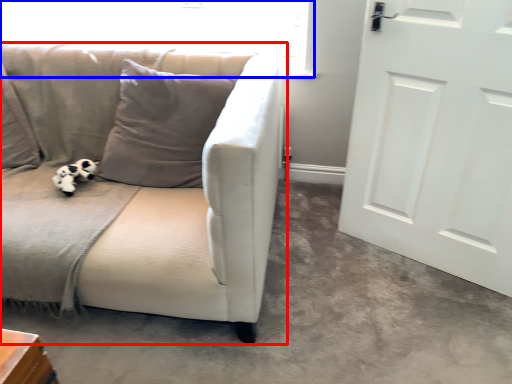
Question: Which point is further to the camera, studio couch (highlighted by a red box) or window screen (highlighted by a blue box)?

Choices:
 (A) studio couch
 (B) window screen

Answer: (B)